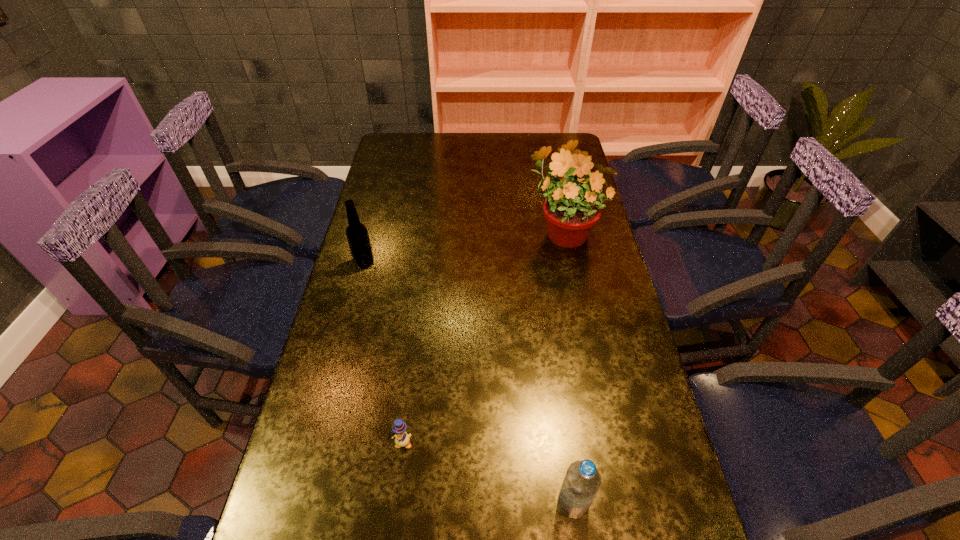
Locate an element on the screen. empty space between the duckling and the farthest object is located at coordinates (483, 337).

You are a GUI agent. You are given a task and a screenshot of the screen. Output one action in this format:
    pyautogui.click(x=<x>, y=<y>)
    Task: Click on the free space between the second object from left to right and the tallest object
    Image resolution: width=960 pixels, height=540 pixels.
    Given the screenshot: What is the action you would take?
    pyautogui.click(x=483, y=337)

Where is `free spot between the shortest object and the tallest object`? free spot between the shortest object and the tallest object is located at coordinates (483, 337).

Image resolution: width=960 pixels, height=540 pixels. Find the location of `vacant region between the water bottle and the duckling`. vacant region between the water bottle and the duckling is located at coordinates (488, 473).

Locate an element on the screen. This screenshot has width=960, height=540. blank region between the nearest object and the shortest object is located at coordinates (488, 473).

Identify the location of empty location between the duckling and the leftmost object. click(x=384, y=353).

Identify the location of free space between the second nearest object and the third shortest object. (384, 353).

Where is `object that is the nearest to the water bottle`? The height and width of the screenshot is (540, 960). object that is the nearest to the water bottle is located at coordinates (402, 439).

Where is `the second closest object to the beer bottle`? This screenshot has width=960, height=540. the second closest object to the beer bottle is located at coordinates (402, 439).

Find the location of `free region that satisfies the following two spatial constraints: 1. on the face of the water bottle, where the monocle is placed; 2. on the left side of the third farthest object`. free region that satisfies the following two spatial constraints: 1. on the face of the water bottle, where the monocle is placed; 2. on the left side of the third farthest object is located at coordinates (396, 503).